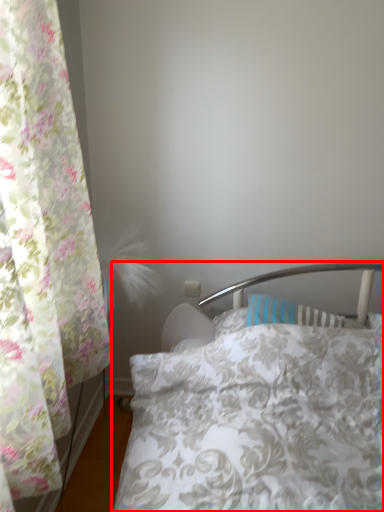
Question: In this image, where is bed (annotated by the red box) located relative to curtain?

Choices:
 (A) left
 (B) right

Answer: (B)